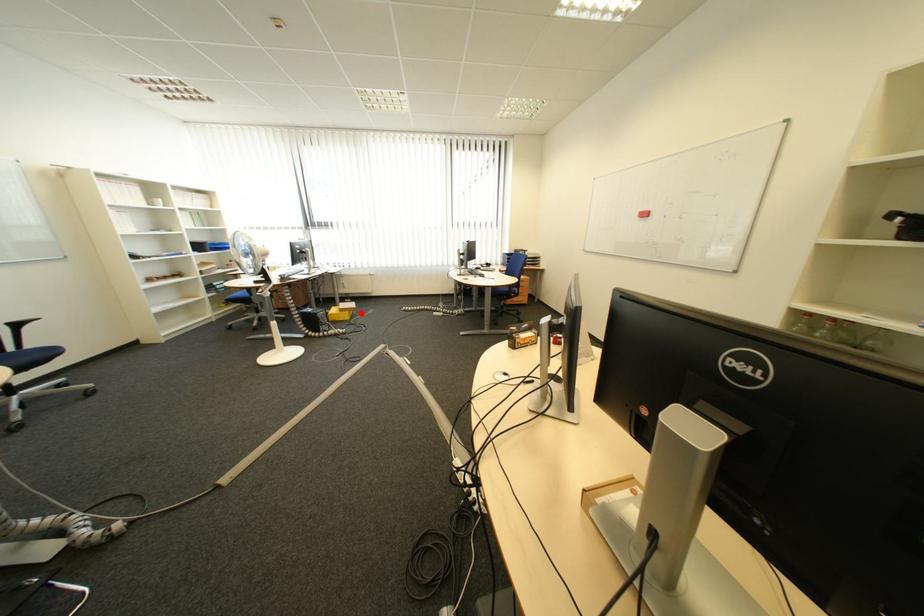
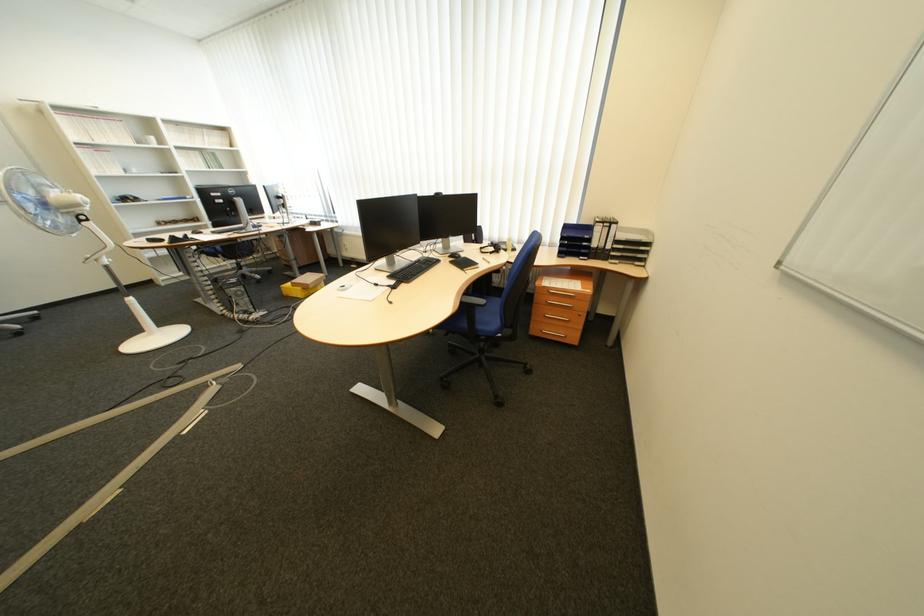
Question: I am providing you with two images of the same scene from different viewpoints. Given a red point in image1, look at the same physical point in image2. Is it:

Choices:
 (A) Closer to the viewpoint
 (B) Farther from the viewpoint

Answer: (B)